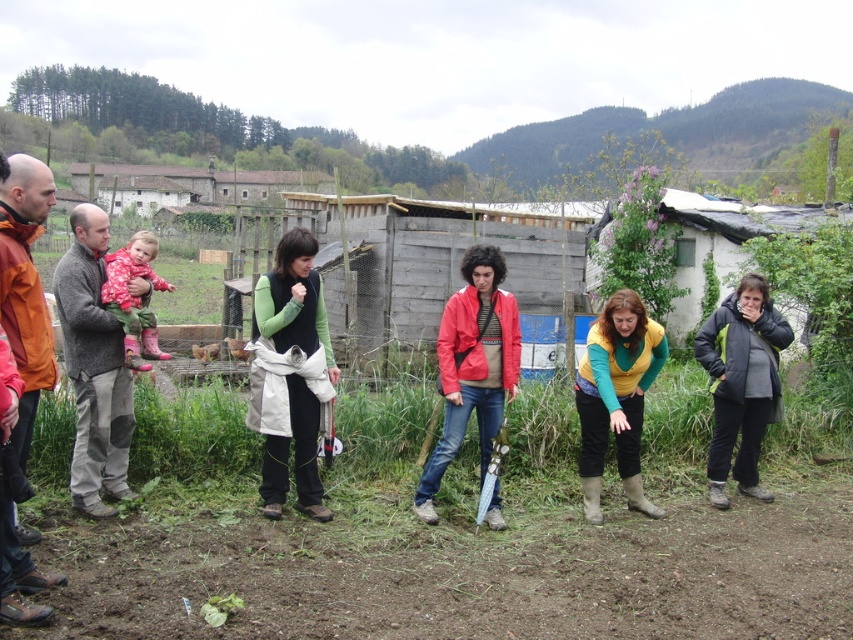
You are standing in the rural setting shown in the image. You see a point marked at coordinate (93,368). What object is located at that point?

The point at coordinate (93,368) corresponds to the knitted wool sweater at left.